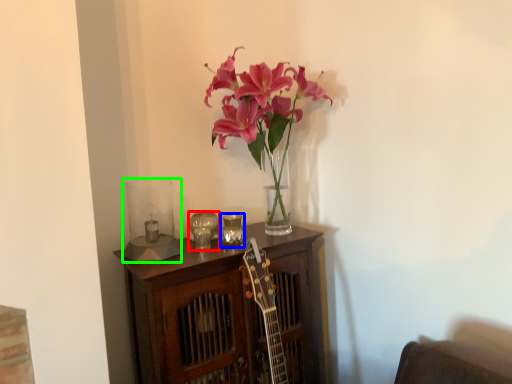
Question: Which object is positioned farthest from candle holder (highlighted by a red box)? Select from candle holder (highlighted by a blue box) and candle holder (highlighted by a green box).

Choices:
 (A) candle holder
 (B) candle holder

Answer: (B)